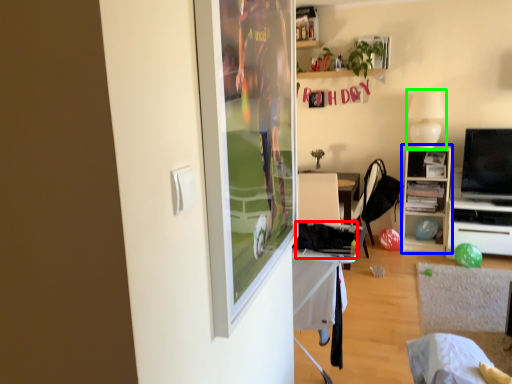
Question: Based on their relative distances, which object is farther from laundry (highlighted by a red box)? Choose from cabinetry (highlighted by a blue box) and lamp (highlighted by a green box).

Choices:
 (A) cabinetry
 (B) lamp

Answer: (A)